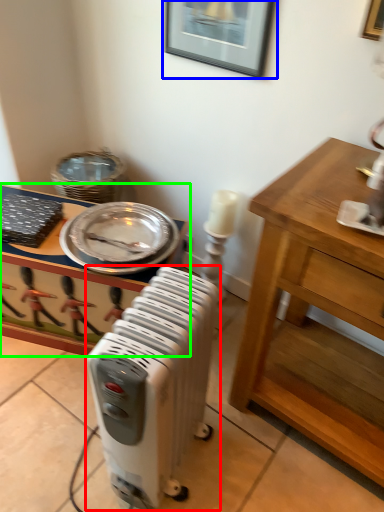
Question: Based on their relative distances, which object is nearer to home appliance (highlighted by a red box)? Choose from picture frame (highlighted by a blue box) and desk (highlighted by a green box).

Choices:
 (A) picture frame
 (B) desk

Answer: (B)